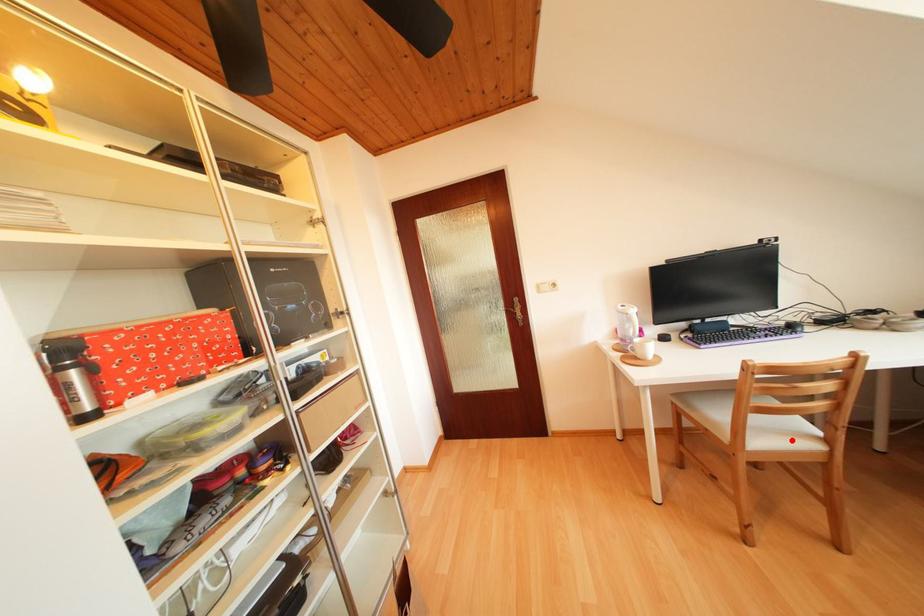
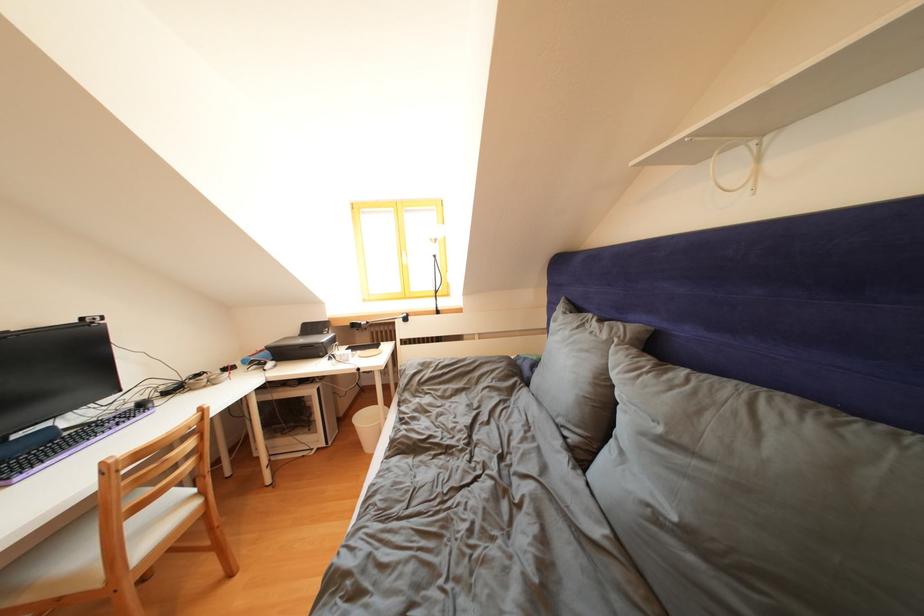
Locate, in the second image, the point that corresponds to the highlighted location in the first image.

(175, 522)